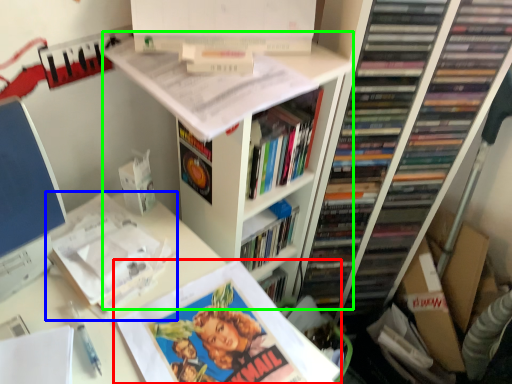
Question: Estimate the real-world distances between objects in this image. Which object is closer to book (highlighted by a red box), book (highlighted by a blue box) or bookshelf (highlighted by a green box)?

Choices:
 (A) book
 (B) bookshelf

Answer: (A)